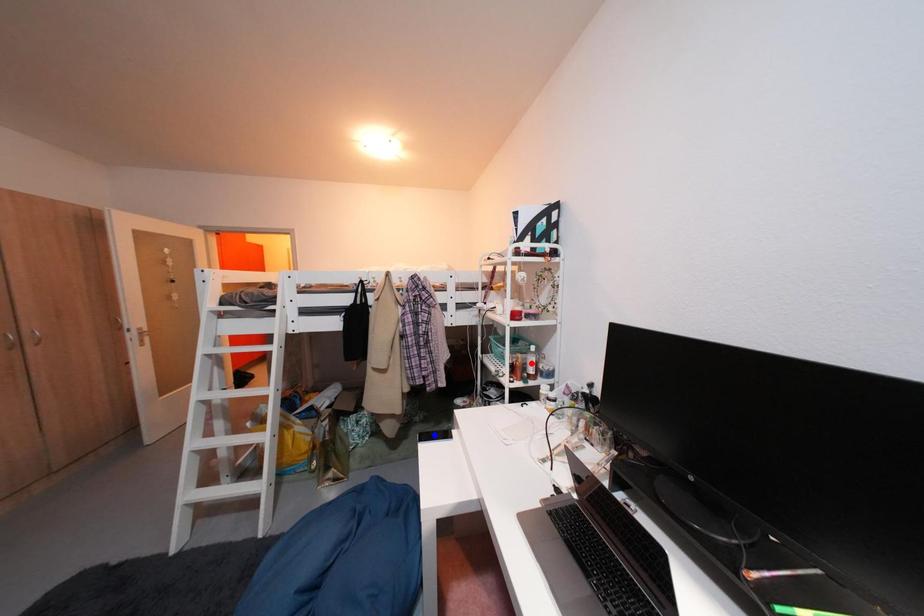
Question: Which of the two points in the image is closer to the camera?

Choices:
 (A) Blue point is closer.
 (B) Red point is closer.

Answer: (B)